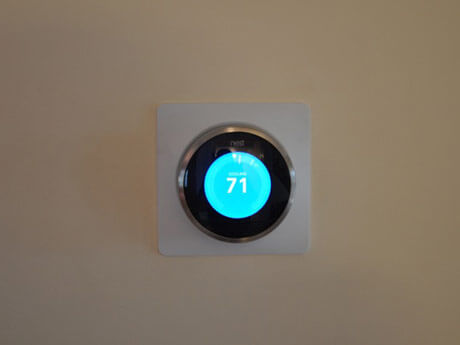
In order to click on empty space on wall to the bottom of thermostat in this screenshot , I will do `click(237, 269)`.